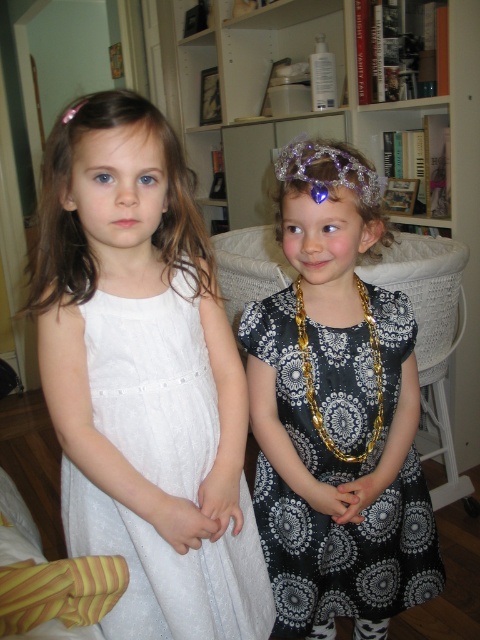
Between point (300, 308) and point (78, 104), which one is positioned in front?

Point (78, 104) is more forward.

The width and height of the screenshot is (480, 640). Identify the location of gold chain necklace at center. (312, 380).

Does point (372, 442) lie behind point (64, 115)?

Yes, point (372, 442) is farther from viewer.

Image resolution: width=480 pixels, height=640 pixels. In order to click on gold chain necklace at center in this screenshot , I will do `click(312, 380)`.

Who is positioned more to the left, sparkly silver tiara at upper right or gold chain necklace at center?

gold chain necklace at center

Is sparkly silver tiara at upper right wider than gold chain necklace at center?

Correct, the width of sparkly silver tiara at upper right exceeds that of gold chain necklace at center.

The image size is (480, 640). What are the coordinates of `sparkly silver tiara at upper right` in the screenshot? It's located at (330, 168).

In order to click on sparkly silver tiara at upper right in this screenshot , I will do `click(330, 168)`.

Can you confirm if black satin dress at center is positioned to the left of white lace dress at left?

No, black satin dress at center is not to the left of white lace dress at left.

Does black satin dress at center appear under white lace dress at left?

No, black satin dress at center is not below white lace dress at left.

I want to click on black satin dress at center, so click(x=336, y=413).